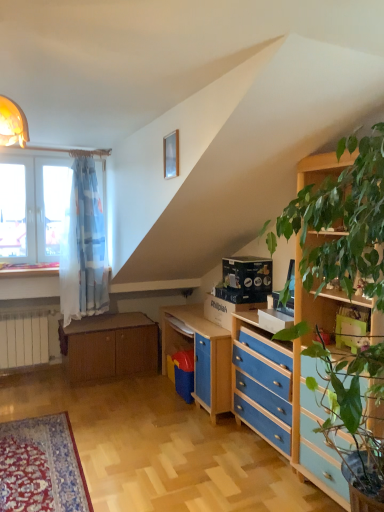
Question: Does blue painted wood chest of drawers at lower right turn towards wooden cabinet at lower left?

Choices:
 (A) no
 (B) yes

Answer: (A)

Question: Considering the relative positions of blue painted wood chest of drawers at lower right and wooden cabinet at lower left in the image provided, is blue painted wood chest of drawers at lower right behind wooden cabinet at lower left?

Choices:
 (A) yes
 (B) no

Answer: (B)

Question: Can you confirm if blue painted wood chest of drawers at lower right is bigger than wooden cabinet at lower left?

Choices:
 (A) yes
 (B) no

Answer: (B)

Question: Is blue painted wood chest of drawers at lower right not close to wooden cabinet at lower left?

Choices:
 (A) no
 (B) yes

Answer: (B)

Question: Is blue painted wood chest of drawers at lower right to the left of wooden cabinet at lower left from the viewer's perspective?

Choices:
 (A) no
 (B) yes

Answer: (A)

Question: From a real-world perspective, does blue painted wood chest of drawers at lower right sit lower than wooden cabinet at lower left?

Choices:
 (A) yes
 (B) no

Answer: (B)

Question: Does wooden at left have a greater width compared to blue painted wood chest of drawers at lower right?

Choices:
 (A) yes
 (B) no

Answer: (B)

Question: Are wooden at left and blue painted wood chest of drawers at lower right located far from each other?

Choices:
 (A) no
 (B) yes

Answer: (B)

Question: Can you confirm if wooden at left is bigger than blue painted wood chest of drawers at lower right?

Choices:
 (A) yes
 (B) no

Answer: (B)

Question: Considering the relative positions of wooden at left and blue painted wood chest of drawers at lower right in the image provided, is wooden at left to the right of blue painted wood chest of drawers at lower right from the viewer's perspective?

Choices:
 (A) yes
 (B) no

Answer: (B)

Question: From the image's perspective, is wooden at left above blue painted wood chest of drawers at lower right?

Choices:
 (A) yes
 (B) no

Answer: (A)

Question: Is wooden at left shorter than blue painted wood chest of drawers at lower right?

Choices:
 (A) yes
 (B) no

Answer: (A)

Question: Does wooden cabinet at lower left appear on the left side of blue painted wood chest of drawers at lower right?

Choices:
 (A) yes
 (B) no

Answer: (A)